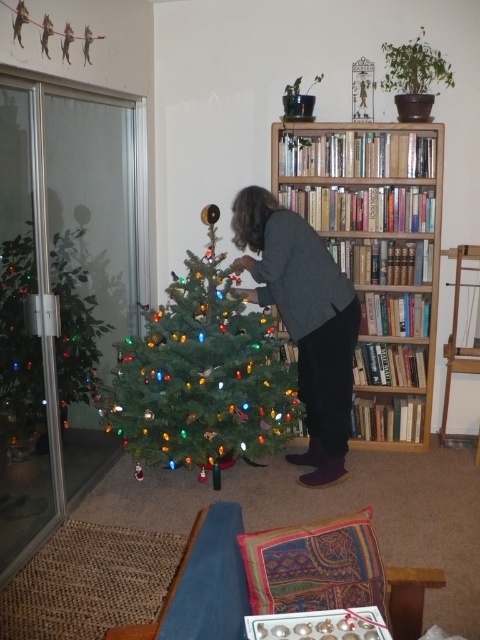
Question: Can you confirm if wooden bookcase at right is positioned to the left of green matte christmas tree at center?

Choices:
 (A) yes
 (B) no

Answer: (B)

Question: In this image, where is wooden bookcase at right located relative to green matte christmas tree at center?

Choices:
 (A) above
 (B) below

Answer: (A)

Question: Which point appears farthest from the camera in this image?

Choices:
 (A) (307, 252)
 (B) (361, 164)

Answer: (B)

Question: Estimate the real-world distances between objects in this image. Which object is farther from the dark gray sweater at center?

Choices:
 (A) wooden bookcase at right
 (B) green matte christmas tree at center

Answer: (A)

Question: Can you confirm if wooden bookcase at right is positioned below green matte christmas tree at center?

Choices:
 (A) no
 (B) yes

Answer: (A)

Question: Estimate the real-world distances between objects in this image. Which object is closer to the dark gray sweater at center?

Choices:
 (A) green matte christmas tree at center
 (B) wooden bookcase at right

Answer: (A)